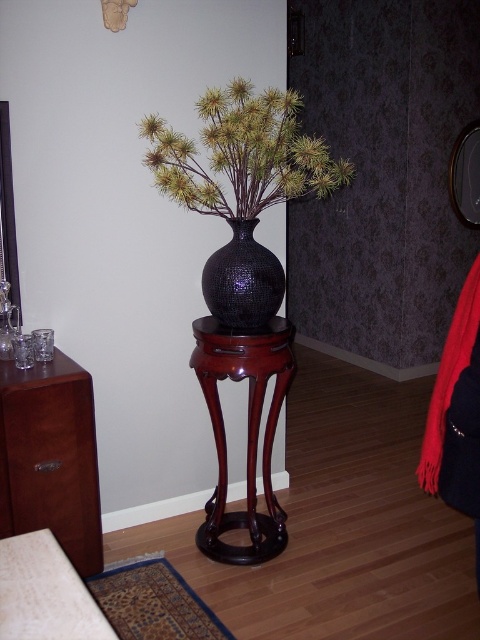
Who is shorter, mahogany wood dresser at left or black textured vase at center?

black textured vase at center

Which of these two, mahogany wood dresser at left or black textured vase at center, stands taller?

mahogany wood dresser at left

This screenshot has height=640, width=480. I want to click on mahogany wood dresser at left, so click(x=50, y=458).

Does mahogany wood side table at center appear over wooden table at lower left?

Correct, mahogany wood side table at center is located above wooden table at lower left.

Is mahogany wood side table at center thinner than wooden table at lower left?

In fact, mahogany wood side table at center might be wider than wooden table at lower left.

Which is in front, point (232, 364) or point (11, 588)?

Point (11, 588) is more forward.

This screenshot has height=640, width=480. Identify the location of mahogany wood side table at center. (248, 432).

Who is positioned more to the left, wooden table at lower left or black textured vase at center?

wooden table at lower left is more to the left.

Can you confirm if wooden table at lower left is thinner than black textured vase at center?

Incorrect, wooden table at lower left's width is not less than black textured vase at center's.

This screenshot has width=480, height=640. I want to click on wooden table at lower left, so click(x=45, y=593).